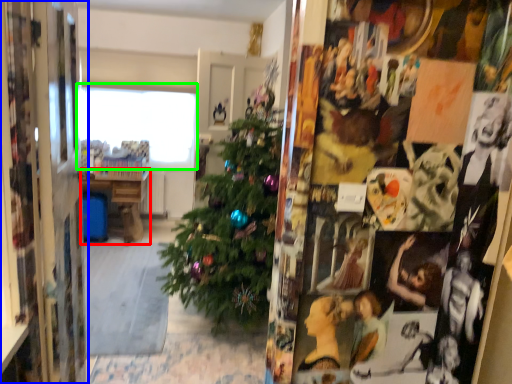
Question: Which object is positioned farthest from table (highlighted by a red box)? Select from collage (highlighted by a blue box) and window (highlighted by a green box).

Choices:
 (A) collage
 (B) window

Answer: (A)